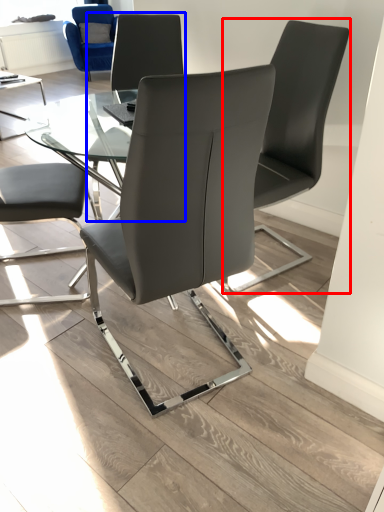
Question: Which point is further to the camera, chair (highlighted by a red box) or chair (highlighted by a blue box)?

Choices:
 (A) chair
 (B) chair

Answer: (B)